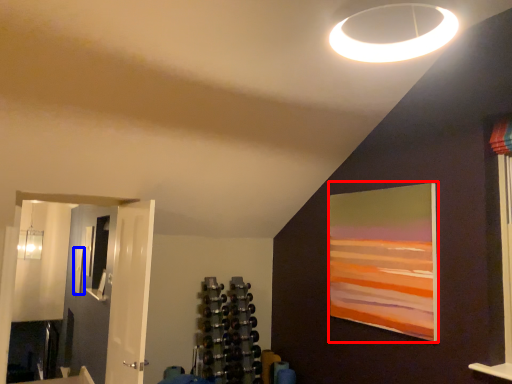
Question: Which point is further to the camera, picture frame (highlighted by a red box) or picture frame (highlighted by a blue box)?

Choices:
 (A) picture frame
 (B) picture frame

Answer: (B)